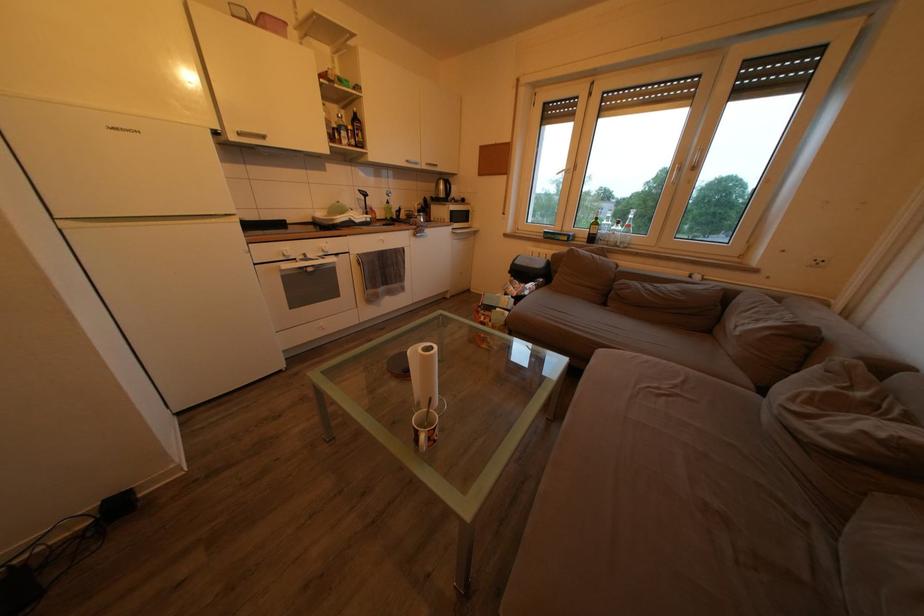
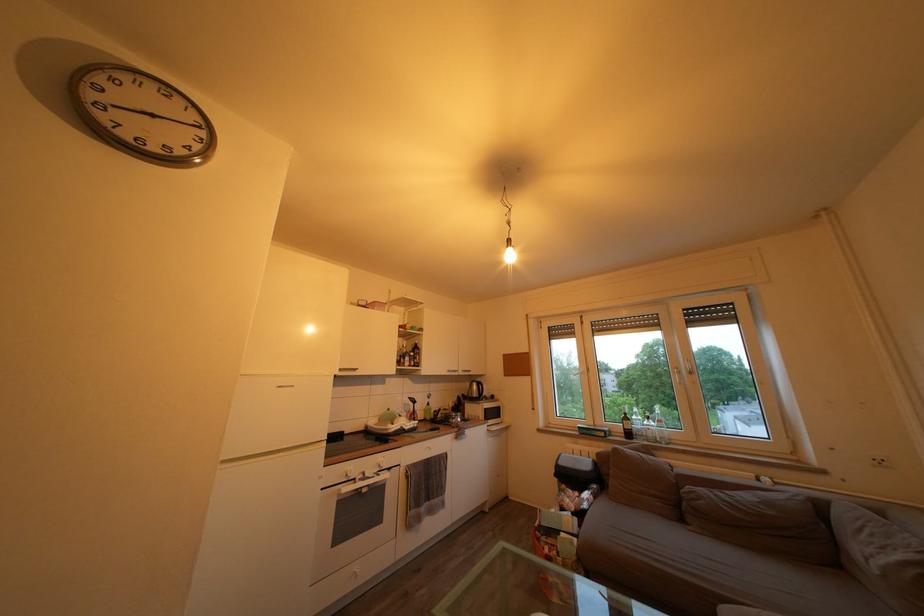
Find the pixel in the second image that matches pixel 456 236 in the first image.

(492, 434)